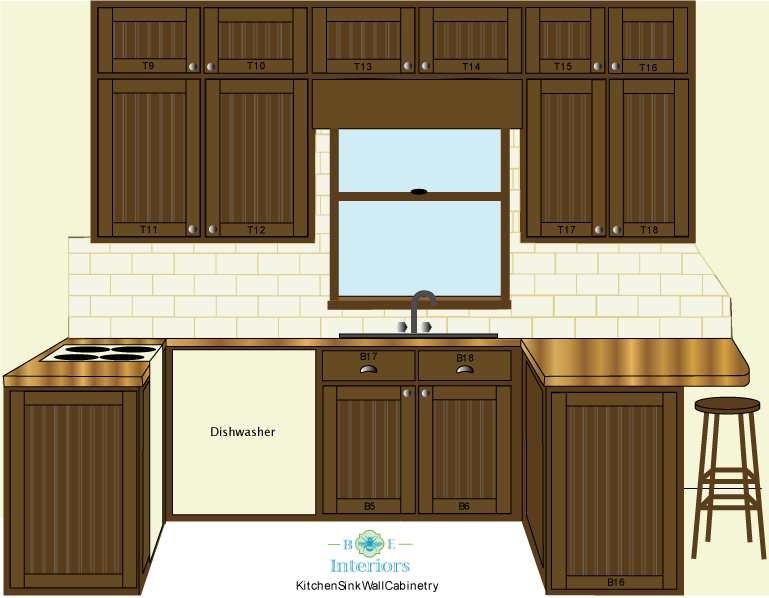
Where is `window`? window is located at coordinates (465, 219).